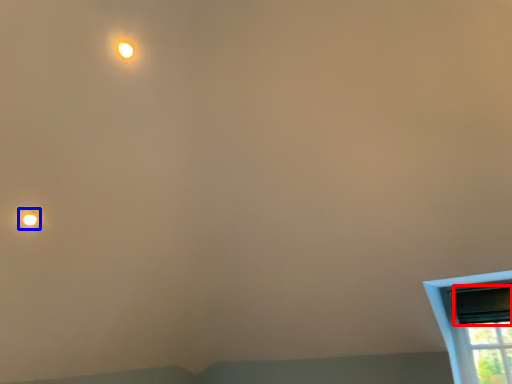
Question: Which of the following is the farthest to the observer, window screen (highlighted by a red box) or droplight (highlighted by a blue box)?

Choices:
 (A) window screen
 (B) droplight

Answer: (A)